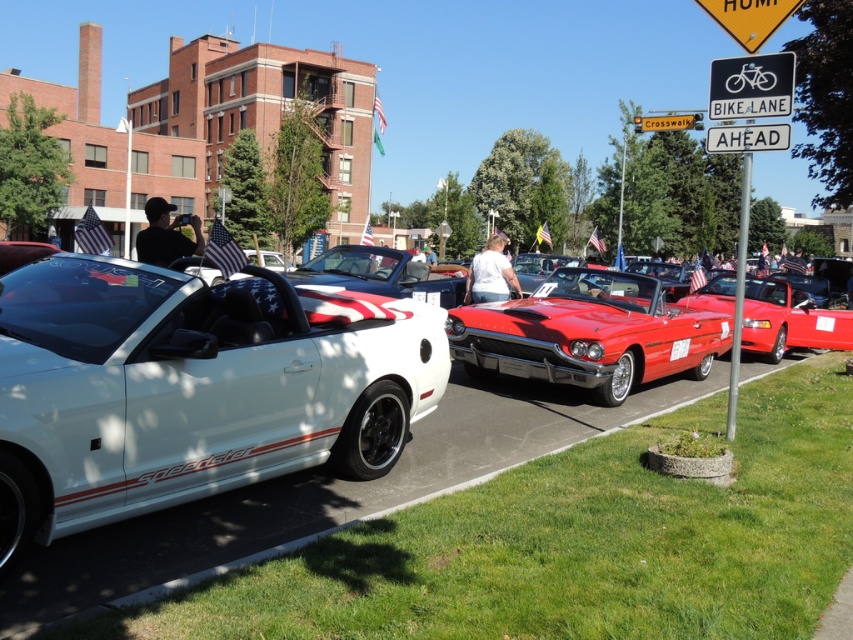
Question: Estimate the real-world distances between objects in this image. Which object is closer to the red matte license plate at center?

Choices:
 (A) white matte convertible at left
 (B) shiny red convertible at center

Answer: (B)

Question: Based on their relative distances, which object is nearer to the black plastic bike lane sign at upper center?

Choices:
 (A) shiny red convertible at center
 (B) white matte convertible at left
 (C) red matte license plate at center

Answer: (A)

Question: Is white matte convertible at left to the left of red matte license plate at center from the viewer's perspective?

Choices:
 (A) no
 (B) yes

Answer: (B)

Question: Is shiny red convertible at center positioned before red matte license plate at center?

Choices:
 (A) yes
 (B) no

Answer: (A)

Question: Is white matte convertible at left closer to the viewer compared to black plastic bike lane sign at upper center?

Choices:
 (A) no
 (B) yes

Answer: (B)

Question: Considering the real-world distances, which object is closest to the red matte license plate at center?

Choices:
 (A) black plastic bike lane sign at upper center
 (B) white matte convertible at left

Answer: (A)